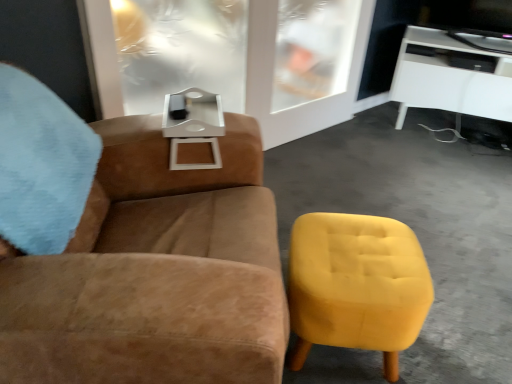
Find the location of a particular element. The height and width of the screenshot is (384, 512). vacant area to the right of yellow fabric ottoman at lower right is located at coordinates (449, 342).